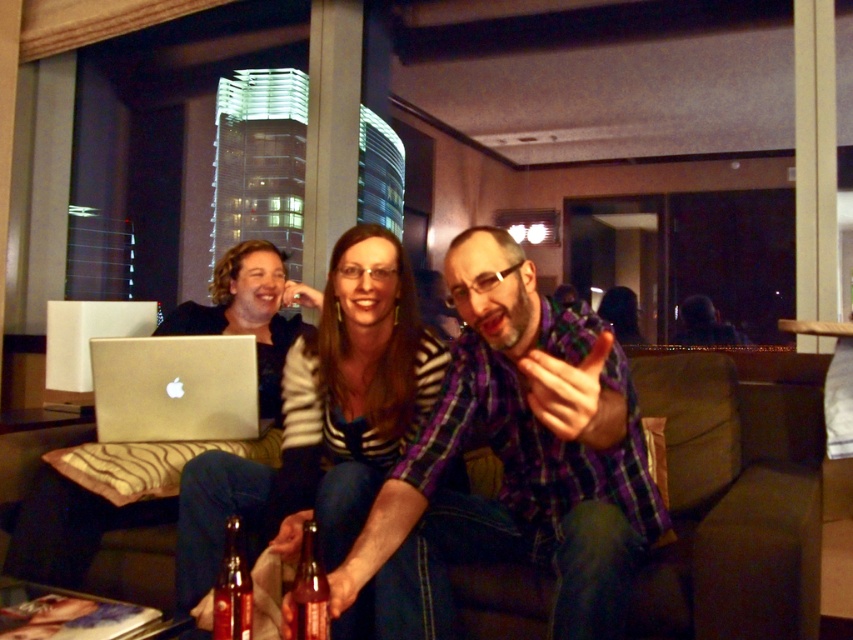
This screenshot has height=640, width=853. Describe the element at coordinates (515, 461) in the screenshot. I see `purple plaid shirt at center` at that location.

Can you confirm if purple plaid shirt at center is taller than metallic silver laptop at left?

Yes, purple plaid shirt at center is taller than metallic silver laptop at left.

Is point (519, 272) positioned behind point (83, 513)?

No, (519, 272) is in front of (83, 513).

The height and width of the screenshot is (640, 853). Find the location of `purple plaid shirt at center`. purple plaid shirt at center is located at coordinates (515, 461).

Consider the image. Does gold metallic laptop at center have a lesser width compared to translucent glass bottle at center?

In fact, gold metallic laptop at center might be wider than translucent glass bottle at center.

Is gold metallic laptop at center closer to camera compared to translucent glass bottle at center?

No.

The height and width of the screenshot is (640, 853). Identify the location of gold metallic laptop at center. (173, 387).

The width and height of the screenshot is (853, 640). I want to click on gold metallic laptop at center, so click(173, 387).

Does point (676, 467) come farther from viewer compared to point (199, 403)?

No.

Who is taller, brown leather couch at center or gold metallic laptop at center?

Standing taller between the two is brown leather couch at center.

Is point (671, 397) farther from viewer compared to point (97, 356)?

Yes, point (671, 397) is farther from viewer.

Where is `brown leather couch at center`? This screenshot has height=640, width=853. brown leather couch at center is located at coordinates (735, 496).